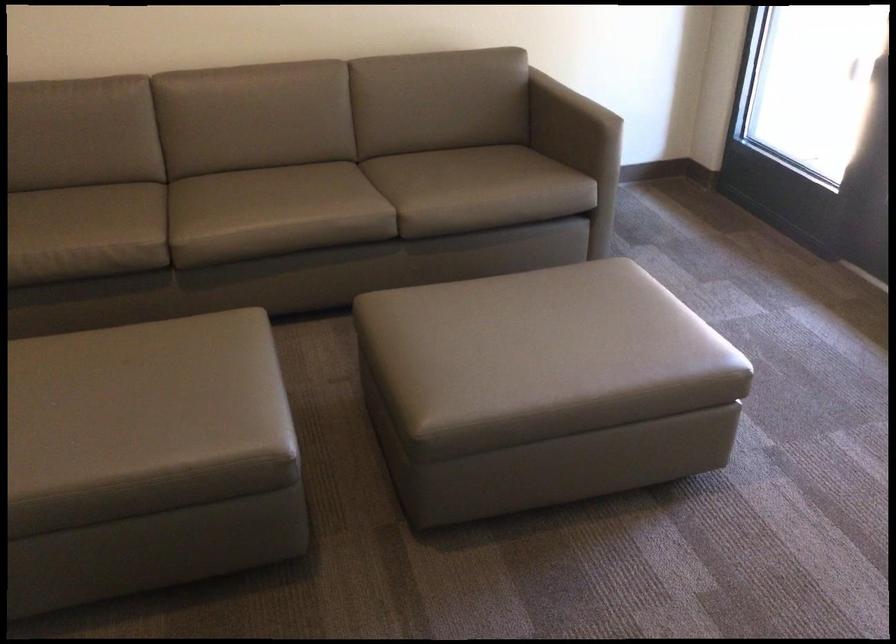
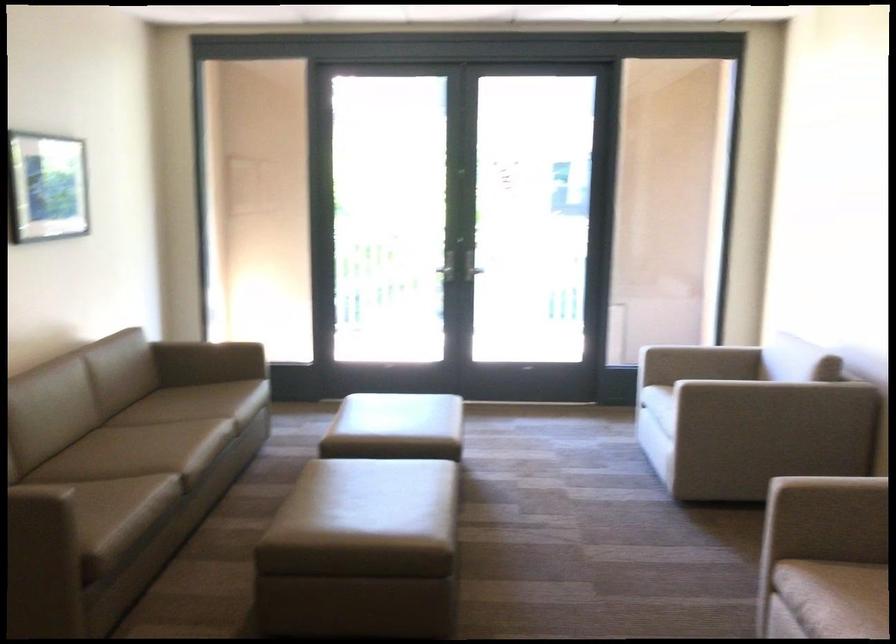
Where in the second image is the point corresponding to pixel 453 145 from the first image?

(122, 399)